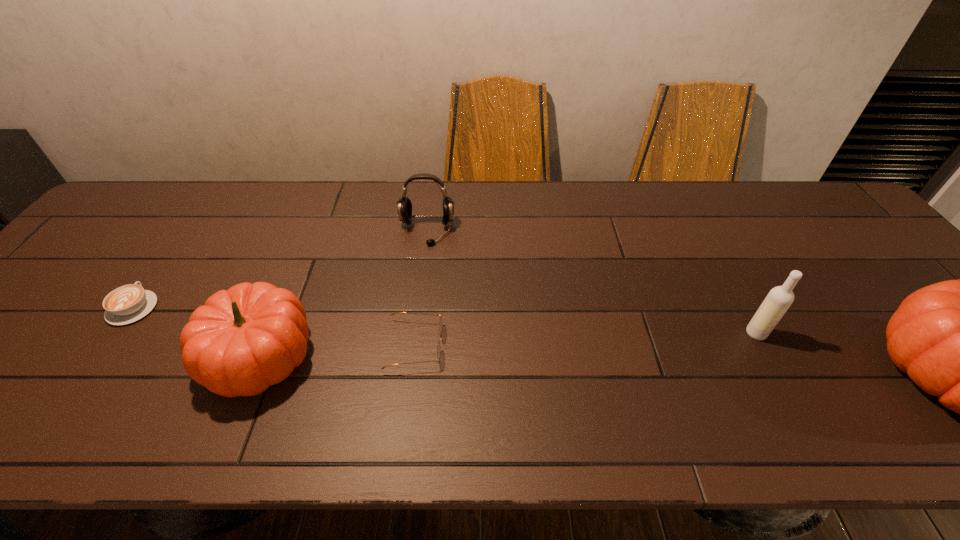
This screenshot has width=960, height=540. In order to click on the second object from left to right in this screenshot , I will do `click(244, 339)`.

This screenshot has height=540, width=960. In order to click on the left pumpkin in this screenshot , I will do `click(244, 339)`.

This screenshot has width=960, height=540. What are the coordinates of `cappuccino` in the screenshot? It's located at (129, 303).

Find the location of a particular element. The width and height of the screenshot is (960, 540). the leftmost object is located at coordinates (129, 303).

Where is `headset`? headset is located at coordinates click(404, 203).

Locate an element on the screen. Image resolution: width=960 pixels, height=540 pixels. spectacles is located at coordinates (441, 323).

Identify the location of vodka. (779, 299).

Find the location of a particular element. Image resolution: width=960 pixels, height=540 pixels. vacant area located 0.150m on the back of the left pumpkin is located at coordinates (297, 269).

Where is `vacant region located on the side of the leftmost object with the handle`? The height and width of the screenshot is (540, 960). vacant region located on the side of the leftmost object with the handle is located at coordinates (207, 204).

Where is `vacant space situated 0.280m on the side of the leftmost object with the handle`? This screenshot has width=960, height=540. vacant space situated 0.280m on the side of the leftmost object with the handle is located at coordinates (195, 220).